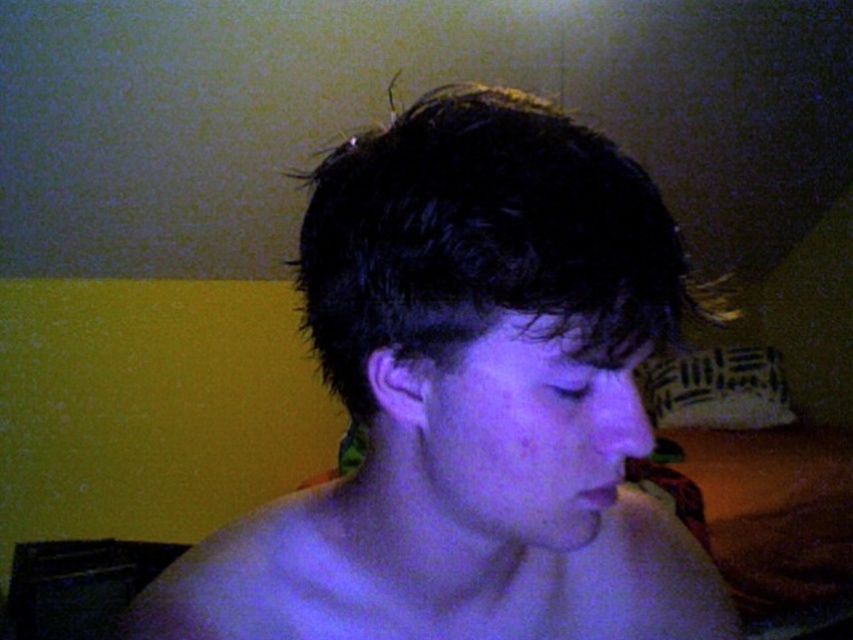
You are a photographer adjusting the focus on your camera. You want to capture both the dark matte hair at center and the yellow wall in the background clearly. Can you do this with a single shot?

The dark matte hair at center and the yellow wall in the background are 26.60 centimeters apart. With a single shot, it might be challenging to have both in focus simultaneously due to the distance between them, depending on your camera settings and lens aperture. Adjusting to a smaller aperture could increase depth of field for better focus on both subjects.

You are a photographer adjusting lighting for a portrait session. You notice the dark matte hair at center and the smooth skin at center. Which object is positioned higher in the image?

The dark matte hair at center is above smooth skin at center, so the dark matte hair at center is positioned higher in the image.